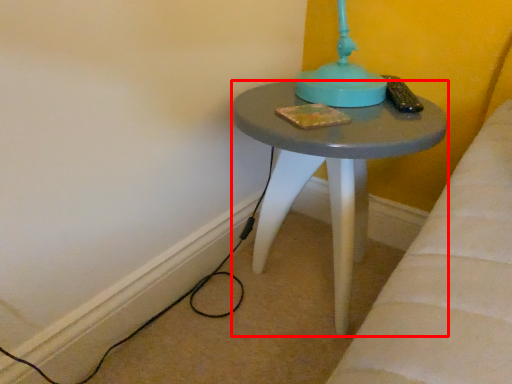
Question: In this image, where is stool (annotated by the red box) located relative to cable?

Choices:
 (A) left
 (B) right

Answer: (B)